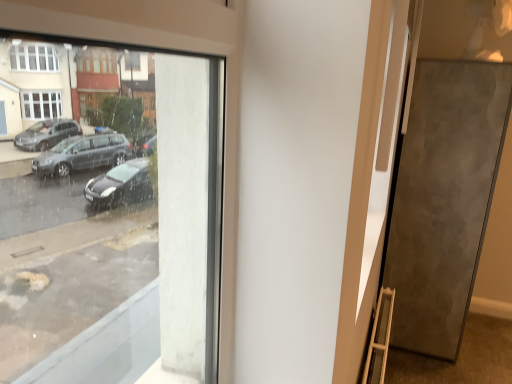
Question: In terms of size, does wooden ladder at lower right appear bigger or smaller than matte gray door at right?

Choices:
 (A) big
 (B) small

Answer: (B)

Question: Is wooden ladder at lower right inside the boundaries of matte gray door at right, or outside?

Choices:
 (A) outside
 (B) inside

Answer: (A)

Question: Which is nearer to the matte gray door at right?

Choices:
 (A) wooden ladder at lower right
 (B) metallic gray pavement at lower right

Answer: (B)

Question: Which object is positioned closest to the metallic gray pavement at lower right?

Choices:
 (A) wooden ladder at lower right
 (B) matte gray door at right

Answer: (B)